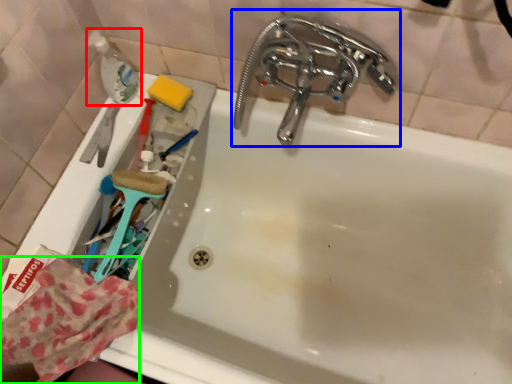
Question: Estimate the real-world distances between objects in this image. Which object is farther from bottle (highlighted by a red box), tap (highlighted by a blue box) or material (highlighted by a green box)?

Choices:
 (A) tap
 (B) material

Answer: (B)